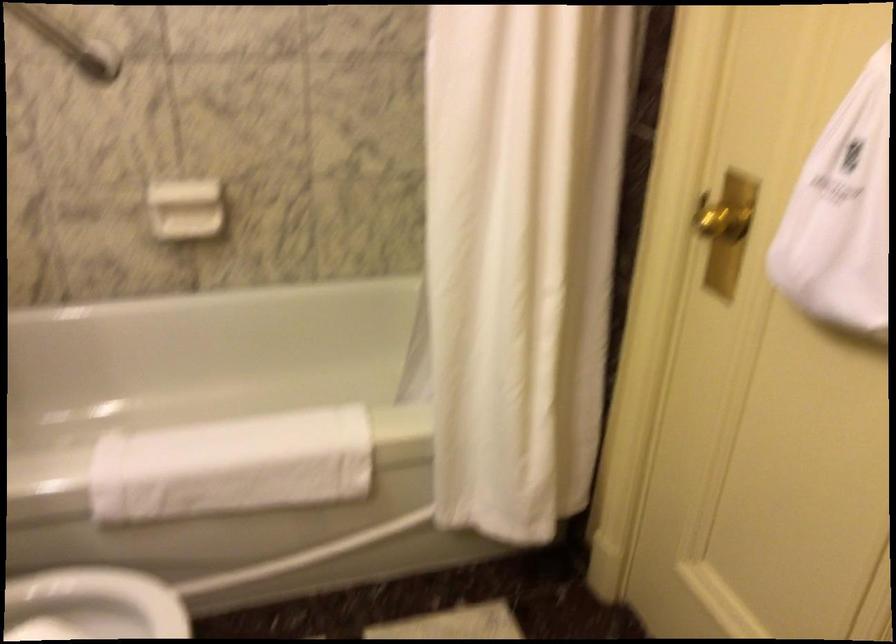
Where is `metal shower head`? metal shower head is located at coordinates (69, 42).